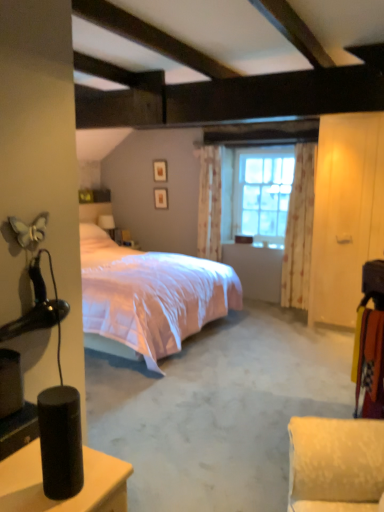
Question: Is floral fabric curtain at right, which ranks as the second curtain in back-to-front order, positioned with its back to matte wooden picture frame at upper center, the second picture frame positioned from the bottom?

Choices:
 (A) no
 (B) yes

Answer: (A)

Question: Considering the relative positions of floral fabric curtain at right, which ranks as the second curtain in back-to-front order, and matte wooden picture frame at upper center, placed as the 1th picture frame when sorted from top to bottom, in the image provided, is floral fabric curtain at right, which ranks as the second curtain in back-to-front order, to the left of matte wooden picture frame at upper center, placed as the 1th picture frame when sorted from top to bottom, from the viewer's perspective?

Choices:
 (A) no
 (B) yes

Answer: (A)

Question: Can you see floral fabric curtain at right, the 1th curtain from the front, touching matte wooden picture frame at upper center, placed as the 1th picture frame when sorted from top to bottom?

Choices:
 (A) no
 (B) yes

Answer: (A)

Question: From the image's perspective, is floral fabric curtain at right, which ranks as the second curtain in back-to-front order, on matte wooden picture frame at upper center, the second picture frame positioned from the bottom?

Choices:
 (A) no
 (B) yes

Answer: (A)

Question: From a real-world perspective, is floral fabric curtain at right, the 1th curtain from the front, located beneath matte wooden picture frame at upper center, the second picture frame positioned from the bottom?

Choices:
 (A) yes
 (B) no

Answer: (A)

Question: Is floral fabric curtain at center, which appears as the 1th curtain when viewed from the left, bigger or smaller than matte white table lamp at center?

Choices:
 (A) big
 (B) small

Answer: (A)

Question: Is floral fabric curtain at center, arranged as the 1th curtain when viewed from the back, situated inside matte white table lamp at center or outside?

Choices:
 (A) inside
 (B) outside

Answer: (B)

Question: From a real-world perspective, relative to matte white table lamp at center, is floral fabric curtain at center, the 2th curtain from the front, vertically above or below?

Choices:
 (A) below
 (B) above

Answer: (B)

Question: In terms of height, does floral fabric curtain at center, the 2th curtain from the front, look taller or shorter compared to matte white table lamp at center?

Choices:
 (A) short
 (B) tall

Answer: (B)

Question: From a real-world perspective, is pink satin bed at center positioned above or below matte wooden picture frame at upper center, the second picture frame positioned from the bottom?

Choices:
 (A) above
 (B) below

Answer: (B)

Question: Is pink satin bed at center spatially inside matte wooden picture frame at upper center, the second picture frame positioned from the bottom, or outside of it?

Choices:
 (A) inside
 (B) outside

Answer: (B)

Question: Considering the positions of point (112, 280) and point (155, 170), is point (112, 280) closer or farther from the camera than point (155, 170)?

Choices:
 (A) farther
 (B) closer

Answer: (B)

Question: Considering the positions of pink satin bed at center and matte wooden picture frame at upper center, placed as the 1th picture frame when sorted from top to bottom, in the image, is pink satin bed at center taller or shorter than matte wooden picture frame at upper center, placed as the 1th picture frame when sorted from top to bottom,?

Choices:
 (A) tall
 (B) short

Answer: (A)

Question: Visually, is floral fabric curtain at right, the 1th curtain from the front, positioned to the left or to the right of matte wooden picture frame at upper center, placed as the 1th picture frame when sorted from top to bottom?

Choices:
 (A) left
 (B) right

Answer: (B)

Question: Is floral fabric curtain at right, the 2th curtain when ordered from left to right, taller or shorter than matte wooden picture frame at upper center, the second picture frame positioned from the bottom?

Choices:
 (A) short
 (B) tall

Answer: (B)